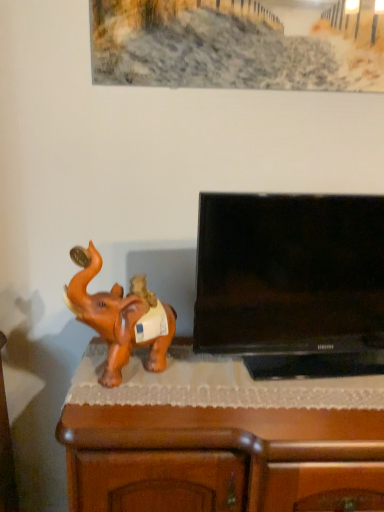
The height and width of the screenshot is (512, 384). In order to click on brown wood cabinet at lower left in this screenshot , I will do `click(220, 438)`.

Where is `black glossy flat-screen tv at right`? The width and height of the screenshot is (384, 512). black glossy flat-screen tv at right is located at coordinates (292, 283).

I want to click on brown glossy elephant at left, so click(120, 316).

Locate an element on the screen. brown wood cabinet at lower left is located at coordinates (220, 438).

Is point (258, 203) positioned behind point (224, 457)?

Yes.

From a real-world perspective, between black glossy flat-screen tv at right and brown wood cabinet at lower left, who is vertically higher?

In real-world perspective, black glossy flat-screen tv at right is above.

Considering their positions, is black glossy flat-screen tv at right located in front of or behind brown wood cabinet at lower left?

black glossy flat-screen tv at right is positioned closer to the viewer than brown wood cabinet at lower left.

Between brown glossy elephant at left and brown wood cabinet at lower left, which one has smaller width?

Thinner between the two is brown glossy elephant at left.

Does brown glossy elephant at left turn towards brown wood cabinet at lower left?

No, brown glossy elephant at left is not turned towards brown wood cabinet at lower left.

Based on the photo, can you tell me how much brown wood cabinet at lower left and black glossy flat-screen tv at right differ in facing direction?

The angular difference between brown wood cabinet at lower left and black glossy flat-screen tv at right is 6.45 degrees.

From a real-world perspective, which is physically above, brown wood cabinet at lower left or black glossy flat-screen tv at right?

black glossy flat-screen tv at right is physically above.

From the image's perspective, relative to black glossy flat-screen tv at right, is brown wood cabinet at lower left above or below?

brown wood cabinet at lower left is situated lower than black glossy flat-screen tv at right in the image.

In the scene shown: Is brown wood cabinet at lower left bigger or smaller than black glossy flat-screen tv at right?

brown wood cabinet at lower left is bigger than black glossy flat-screen tv at right.

Are black glossy flat-screen tv at right and brown glossy elephant at left located far from each other?

Actually, black glossy flat-screen tv at right and brown glossy elephant at left are a little close together.

Which of these two, black glossy flat-screen tv at right or brown glossy elephant at left, is smaller?

Smaller between the two is brown glossy elephant at left.

Considering the sizes of objects black glossy flat-screen tv at right and brown glossy elephant at left in the image provided, who is thinner, black glossy flat-screen tv at right or brown glossy elephant at left?

brown glossy elephant at left.

Can you confirm if brown glossy elephant at left is thinner than black glossy flat-screen tv at right?

Correct, the width of brown glossy elephant at left is less than that of black glossy flat-screen tv at right.

Based on the photo, is brown glossy elephant at left taller than black glossy flat-screen tv at right?

No.

How different are the orientations of brown glossy elephant at left and black glossy flat-screen tv at right in degrees?

17.3 degrees.

From the image's perspective, which object appears higher, brown glossy elephant at left or black glossy flat-screen tv at right?

black glossy flat-screen tv at right.

From a real-world perspective, is brown wood cabinet at lower left physically located above or below brown glossy elephant at left?

In terms of real-world spatial position, brown wood cabinet at lower left is below brown glossy elephant at left.

Looking at the image, does brown wood cabinet at lower left seem bigger or smaller compared to brown glossy elephant at left?

brown wood cabinet at lower left is bigger than brown glossy elephant at left.

In the scene shown: Is brown wood cabinet at lower left to the left of brown glossy elephant at left from the viewer's perspective?

In fact, brown wood cabinet at lower left is to the right of brown glossy elephant at left.

Is brown wood cabinet at lower left wider than brown glossy elephant at left?

Yes.

Locate an element on the screen. The height and width of the screenshot is (512, 384). television that is on the right side of brown wood cabinet at lower left is located at coordinates (292, 283).

Image resolution: width=384 pixels, height=512 pixels. Identify the location of furniture that appears below the brown glossy elephant at left (from a real-world perspective). [220, 438].

From the image, which object appears to be nearer to brown glossy elephant at left, black glossy flat-screen tv at right or brown wood cabinet at lower left?

Among the two, brown wood cabinet at lower left is located nearer to brown glossy elephant at left.

Estimate the real-world distances between objects in this image. Which object is closer to black glossy flat-screen tv at right, brown wood cabinet at lower left or brown glossy elephant at left?

Based on the image, brown wood cabinet at lower left appears to be nearer to black glossy flat-screen tv at right.

Based on their spatial positions, is brown wood cabinet at lower left or black glossy flat-screen tv at right closer to brown glossy elephant at left?

Among the two, brown wood cabinet at lower left is located nearer to brown glossy elephant at left.

Which object lies further to the anchor point brown wood cabinet at lower left, black glossy flat-screen tv at right or brown glossy elephant at left?

black glossy flat-screen tv at right is positioned further to the anchor brown wood cabinet at lower left.

Which object lies further to the anchor point brown wood cabinet at lower left, brown glossy elephant at left or black glossy flat-screen tv at right?

black glossy flat-screen tv at right is positioned further to the anchor brown wood cabinet at lower left.

Considering their positions, is brown glossy elephant at left positioned closer to black glossy flat-screen tv at right than brown wood cabinet at lower left?

brown wood cabinet at lower left is closer to black glossy flat-screen tv at right.

This screenshot has width=384, height=512. Find the location of `furniture between brown glossy elephant at left and black glossy flat-screen tv at right`. furniture between brown glossy elephant at left and black glossy flat-screen tv at right is located at coordinates (220, 438).